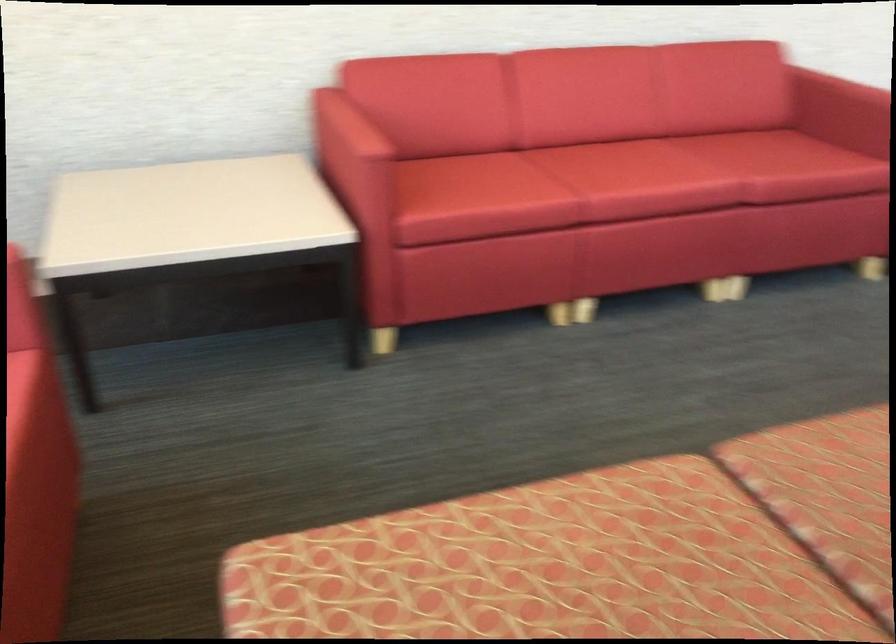
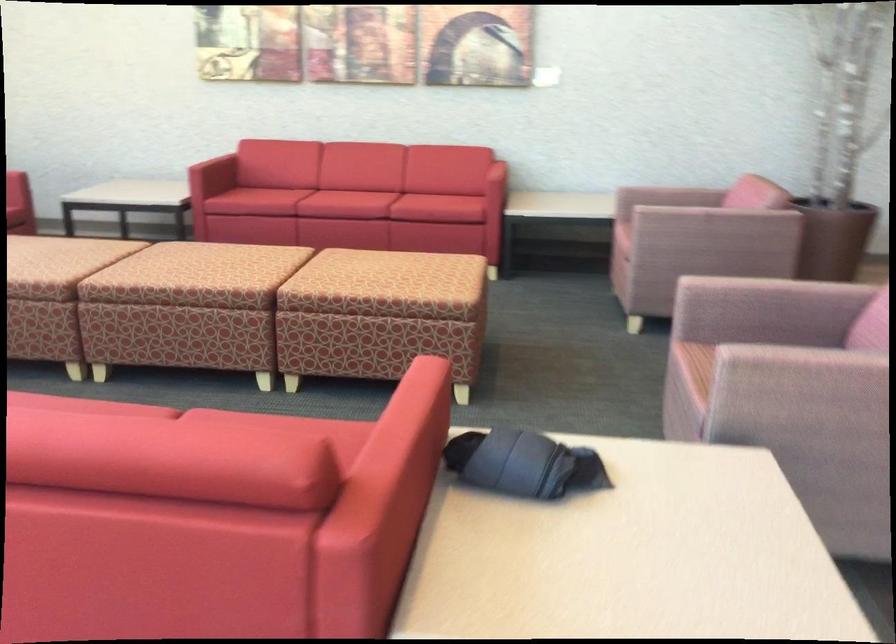
Locate, in the second image, the point that corresponds to point 545,243 in the first image.

(265, 200)